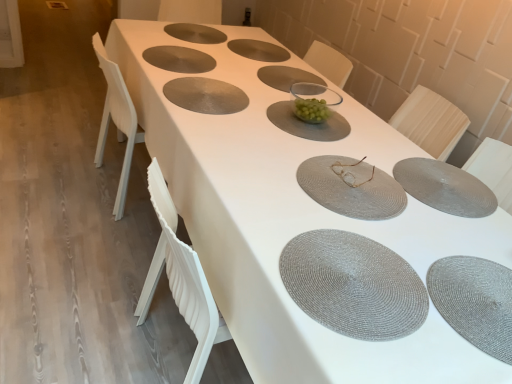
Locate an element on the screen. This screenshot has width=512, height=384. spots to the right of gold metallic glasses at center, which is the fourth tableware from bottom to top is located at coordinates (409, 180).